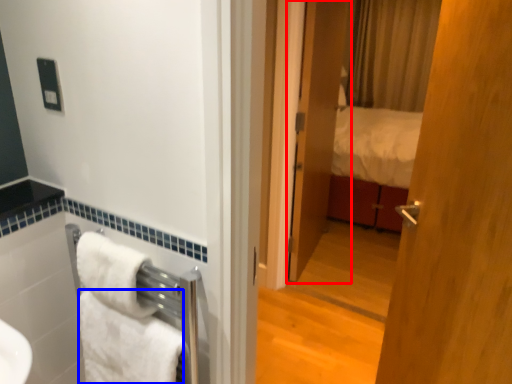
Question: Among these objects, which one is nearest to the camera, door (highlighted by a red box) or towel/napkin (highlighted by a blue box)?

Choices:
 (A) door
 (B) towel/napkin

Answer: (B)